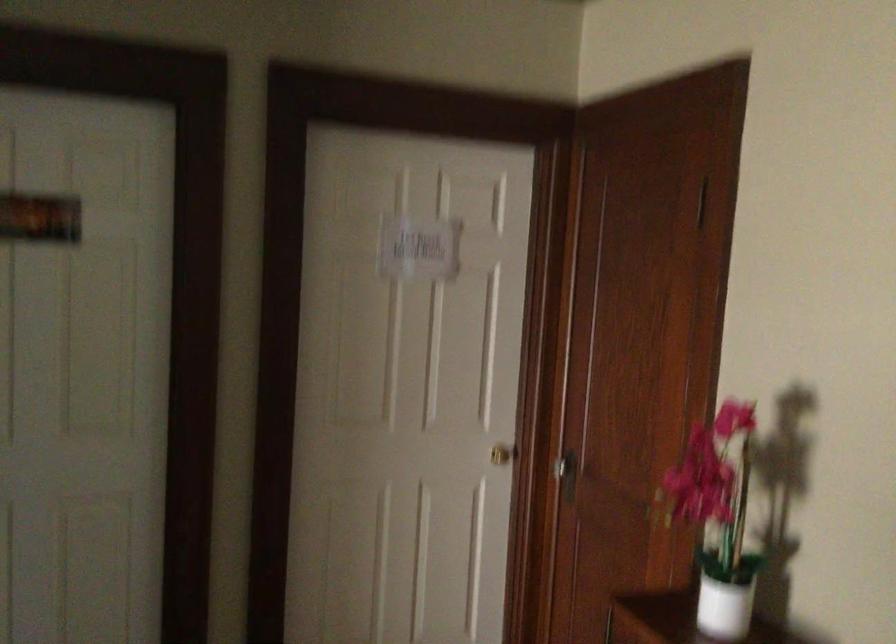
Locate an element on the screen. This screenshot has height=644, width=896. white plant pot is located at coordinates (725, 607).